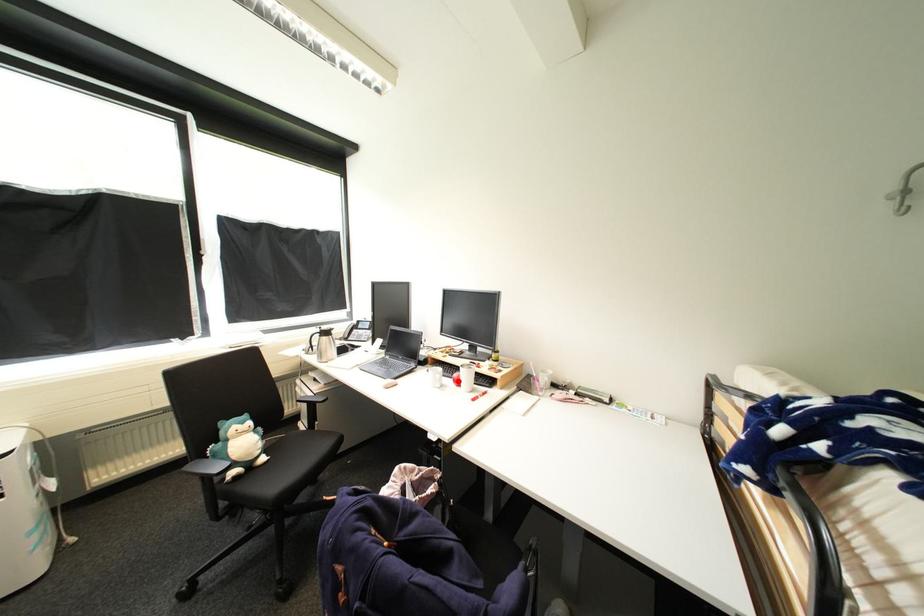
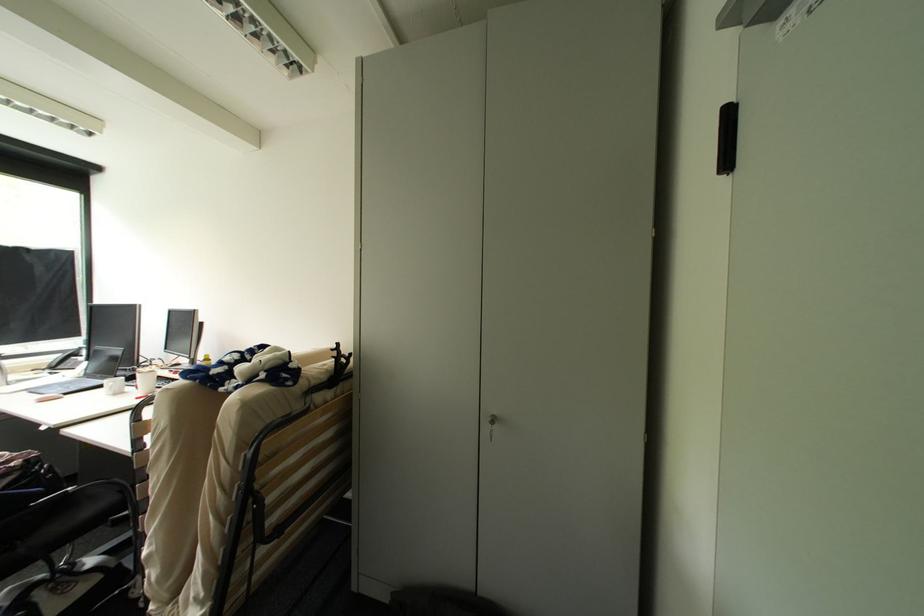
The point at the highlighted location is marked in the first image. Where is the corresponding point in the second image?

(141, 387)